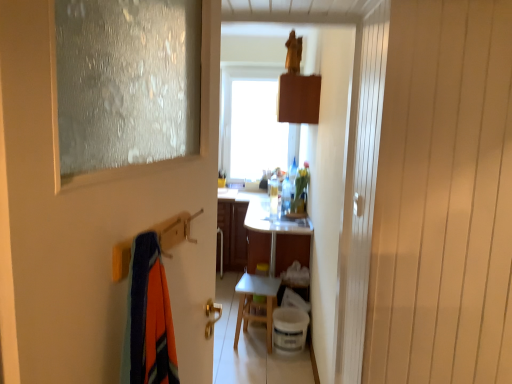
Where is `vacant space situated above white matte table at center (from a real-world perspective)`? vacant space situated above white matte table at center (from a real-world perspective) is located at coordinates (259, 281).